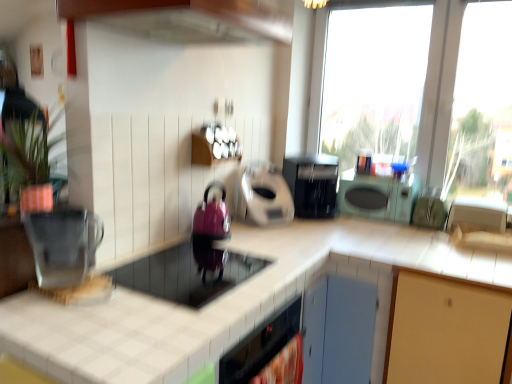
Question: Can you confirm if green matte plant at upper left is wider than metallic silver toaster at right, the 5th appliance when ordered from left to right?

Choices:
 (A) yes
 (B) no

Answer: (B)

Question: From the image's perspective, would you say green matte plant at upper left is positioned over metallic silver toaster at right, positioned as the 1th appliance in right-to-left order?

Choices:
 (A) yes
 (B) no

Answer: (A)

Question: Is metallic silver toaster at right, the 5th appliance when ordered from left to right, a part of green matte plant at upper left?

Choices:
 (A) no
 (B) yes

Answer: (A)

Question: Is the depth of green matte plant at upper left greater than that of metallic silver toaster at right, positioned as the 1th appliance in right-to-left order?

Choices:
 (A) yes
 (B) no

Answer: (B)

Question: From a real-world perspective, is green matte plant at upper left physically above metallic silver toaster at right, the 5th appliance when ordered from left to right?

Choices:
 (A) no
 (B) yes

Answer: (B)

Question: Is green matte plant at upper left aimed at metallic silver toaster at right, the 5th appliance when ordered from left to right?

Choices:
 (A) no
 (B) yes

Answer: (A)

Question: Does green matte plant at upper left have a larger size compared to matte pink kettle at center, which is counted as the third appliance, starting from the right?

Choices:
 (A) no
 (B) yes

Answer: (B)

Question: Is green matte plant at upper left positioned in front of matte pink kettle at center, the third appliance viewed from the left?

Choices:
 (A) no
 (B) yes

Answer: (B)

Question: From the image's perspective, does green matte plant at upper left appear lower than matte pink kettle at center, which is counted as the third appliance, starting from the right?

Choices:
 (A) yes
 (B) no

Answer: (B)

Question: Does green matte plant at upper left have a smaller size compared to matte pink kettle at center, which is counted as the third appliance, starting from the right?

Choices:
 (A) yes
 (B) no

Answer: (B)

Question: Are green matte plant at upper left and matte pink kettle at center, which is counted as the third appliance, starting from the right, beside each other?

Choices:
 (A) yes
 (B) no

Answer: (B)

Question: Is green matte plant at upper left not close to matte pink kettle at center, which is counted as the third appliance, starting from the right?

Choices:
 (A) no
 (B) yes

Answer: (A)

Question: Does black plastic coffee maker at center have a greater height compared to metallic silver toaster at right, positioned as the 1th appliance in right-to-left order?

Choices:
 (A) no
 (B) yes

Answer: (B)